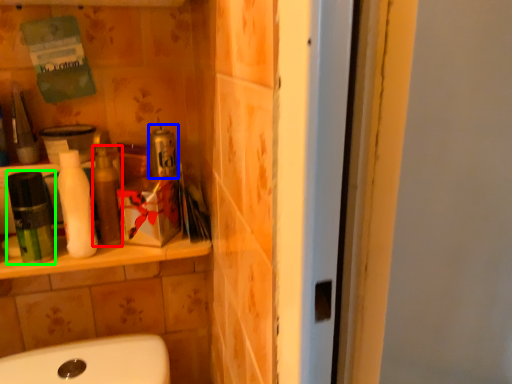
Question: Which object is the farthest from toiletry (highlighted by a red box)? Choose among these: product (highlighted by a blue box) or mouthwash (highlighted by a green box).

Choices:
 (A) product
 (B) mouthwash

Answer: (B)